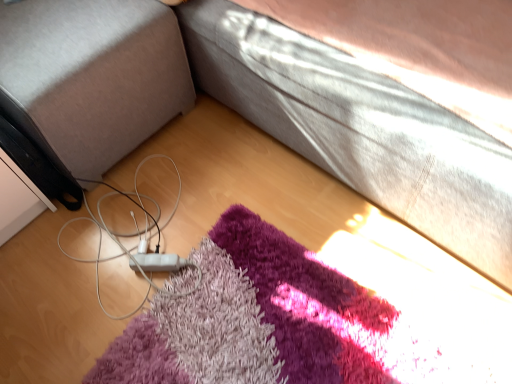
Locate an element on the screen. The image size is (512, 384). vacant area in front of white matte cable at lower left is located at coordinates 138,350.